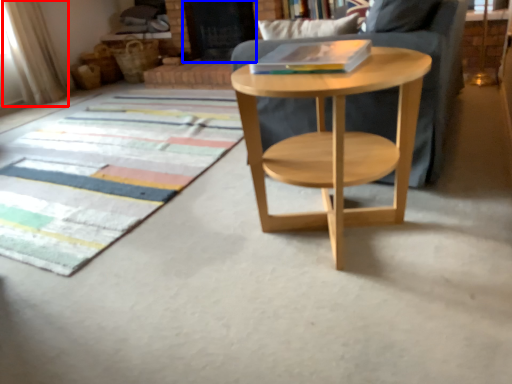
Question: Which of the following is the farthest to the observer, curtain (highlighted by a red box) or screen door (highlighted by a blue box)?

Choices:
 (A) curtain
 (B) screen door

Answer: (B)